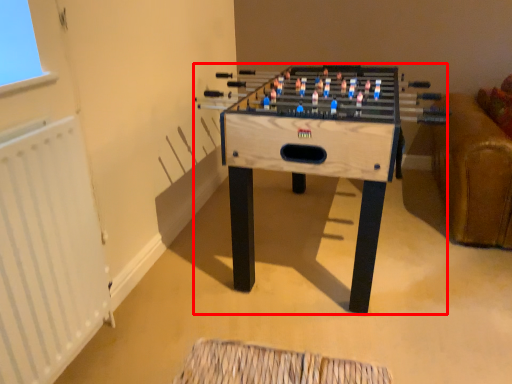
Question: From the image's perspective, what is the correct spatial positioning of table (annotated by the red box) in reference to radiator?

Choices:
 (A) above
 (B) below

Answer: (A)